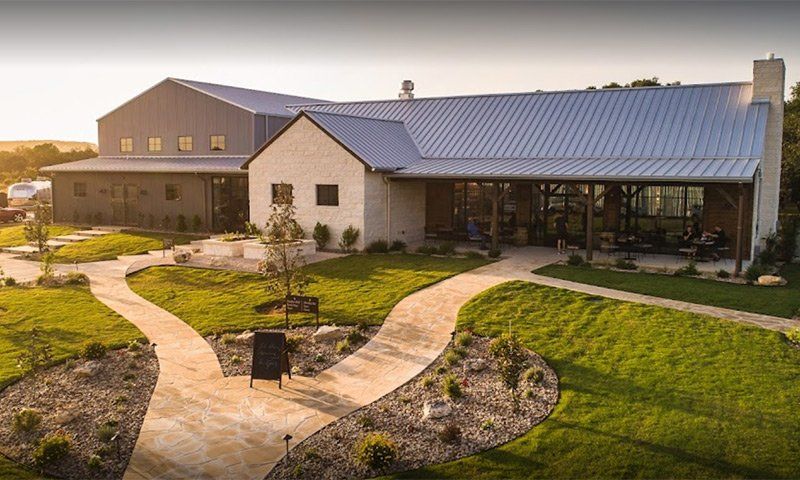
Where is `cement chimney`? The height and width of the screenshot is (480, 800). cement chimney is located at coordinates (768, 84).